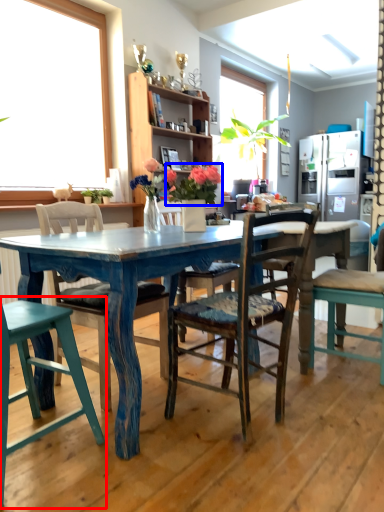
Question: Which of the following is the closest to the observer, chair (highlighted by a red box) or floral arrangement (highlighted by a blue box)?

Choices:
 (A) chair
 (B) floral arrangement

Answer: (A)